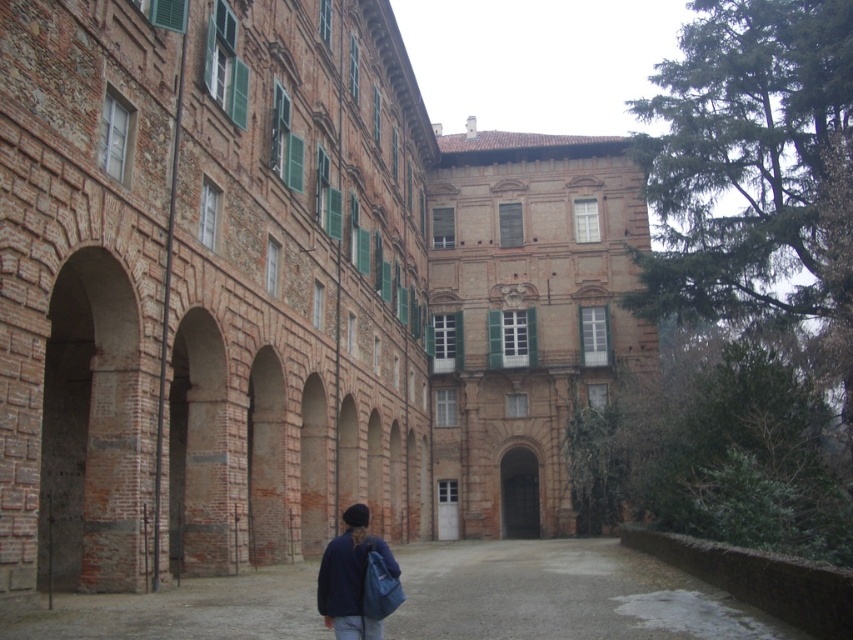
Question: Which object is farther from the camera taking this photo?

Choices:
 (A) smooth brick courtyard at center
 (B) dark blue fabric jacket at lower center

Answer: (A)

Question: Can you confirm if smooth brick courtyard at center is positioned to the right of dark blue fabric jacket at lower center?

Choices:
 (A) no
 (B) yes

Answer: (B)

Question: Considering the relative positions of smooth brick courtyard at center and dark blue fabric jacket at lower center in the image provided, where is smooth brick courtyard at center located with respect to dark blue fabric jacket at lower center?

Choices:
 (A) below
 (B) above

Answer: (A)

Question: Does smooth brick courtyard at center lie behind dark blue fabric jacket at lower center?

Choices:
 (A) no
 (B) yes

Answer: (B)

Question: Which object appears farthest from the camera in this image?

Choices:
 (A) smooth brick courtyard at center
 (B) dark blue fabric jacket at lower center

Answer: (A)